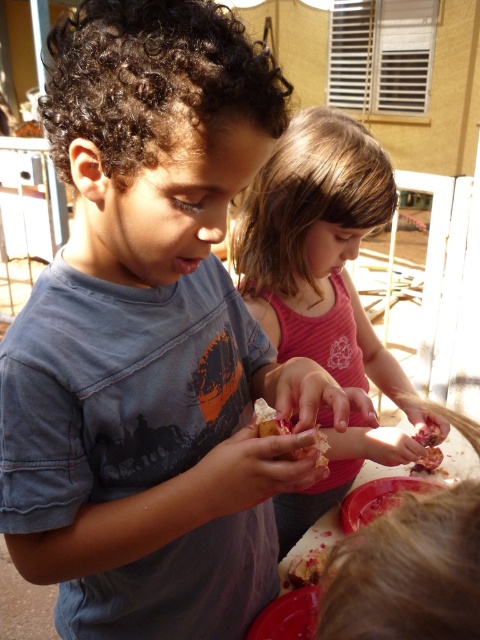
Question: Which of the following is the farthest from the observer?

Choices:
 (A) matte gray shirt at center
 (B) pink glossy fruit at center
 (C) pink matte food at center
 (D) pink cotton shirt at center

Answer: (B)

Question: Which object is farther from the camera taking this photo?

Choices:
 (A) matte gray shirt at center
 (B) pink glossy fruit at center
 (C) pink cotton shirt at center
 (D) pink matte food at center

Answer: (B)

Question: Which point is closer to the camera taking this photo?

Choices:
 (A) (430, 440)
 (B) (38, 342)

Answer: (B)

Question: From the image, what is the correct spatial relationship of pink cotton shirt at center in relation to pink glossy fruit at center?

Choices:
 (A) below
 (B) above

Answer: (B)

Question: Is the position of matte gray shirt at center less distant than that of pink matte food at center?

Choices:
 (A) no
 (B) yes

Answer: (B)

Question: Does matte gray shirt at center have a greater width compared to pink matte food at center?

Choices:
 (A) no
 (B) yes

Answer: (B)